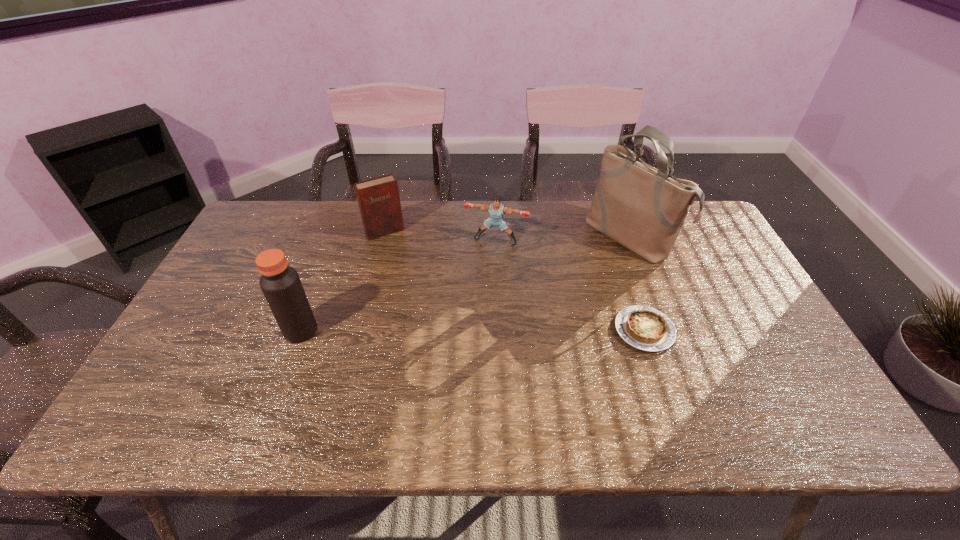
Locate an element on the screen. vinegar is located at coordinates (280, 283).

I want to click on the leftmost object, so click(280, 283).

Where is `the shortest object`? the shortest object is located at coordinates (645, 328).

What are the coordinates of `the third object from left to right` in the screenshot? It's located at (496, 210).

The height and width of the screenshot is (540, 960). What are the coordinates of `the second shortest object` in the screenshot? It's located at (496, 210).

The height and width of the screenshot is (540, 960). I want to click on the second object from left to right, so click(379, 202).

The width and height of the screenshot is (960, 540). In order to click on diary in this screenshot , I will do `click(379, 202)`.

Locate an element on the screen. shoulder bag is located at coordinates (643, 208).

Locate an element on the screen. This screenshot has height=540, width=960. vacant point located on the left of the vinegar is located at coordinates (192, 330).

The image size is (960, 540). In order to click on vacant space located on the back of the quiche in this screenshot , I will do tap(632, 293).